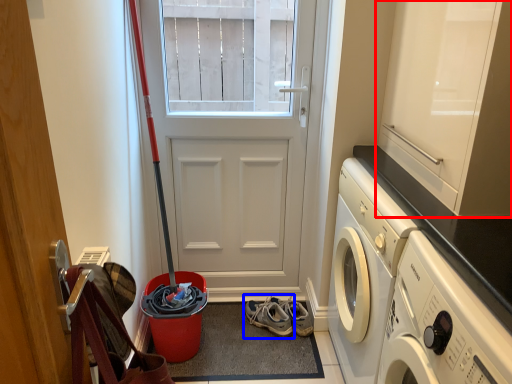
Question: Which object appears closest to the camera in this image, cabinetry (highlighted by a red box) or footwear (highlighted by a blue box)?

Choices:
 (A) cabinetry
 (B) footwear

Answer: (A)